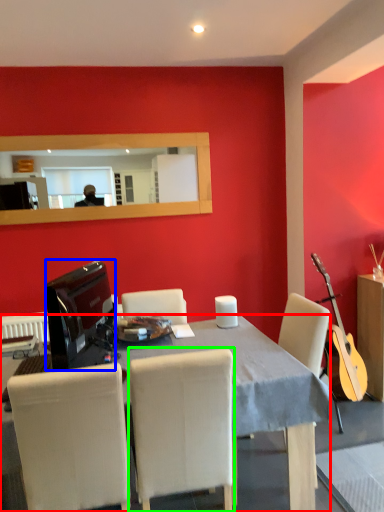
Question: Which object is positioned farthest from desk (highlighted by a red box)? Select from television (highlighted by a blue box) and chair (highlighted by a green box).

Choices:
 (A) television
 (B) chair

Answer: (A)